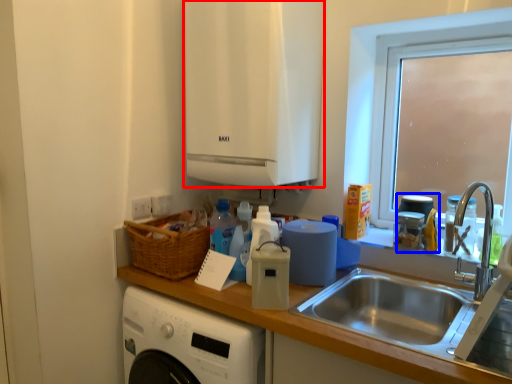
Question: Which point is further to the camera, cabinetry (highlighted by a red box) or appliance (highlighted by a blue box)?

Choices:
 (A) cabinetry
 (B) appliance

Answer: (B)